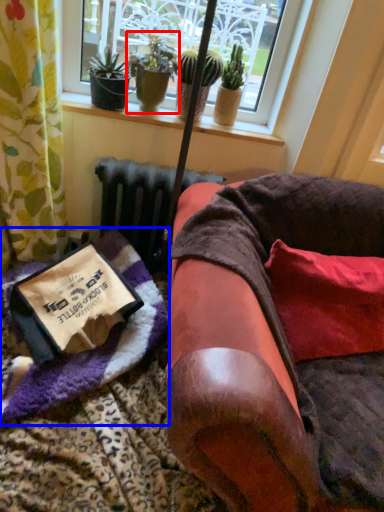
Question: Which object is further to the camera taking this photo, houseplant (highlighted by a red box) or blanket (highlighted by a blue box)?

Choices:
 (A) houseplant
 (B) blanket

Answer: (A)